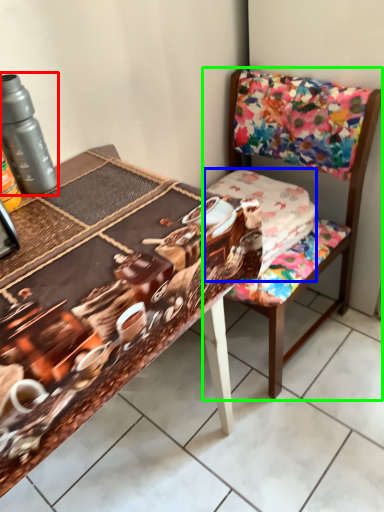
Question: Which object is positioned closest to bottle (highlighted by a red box)? Select from fabric (highlighted by a blue box) and chair (highlighted by a green box).

Choices:
 (A) fabric
 (B) chair

Answer: (A)